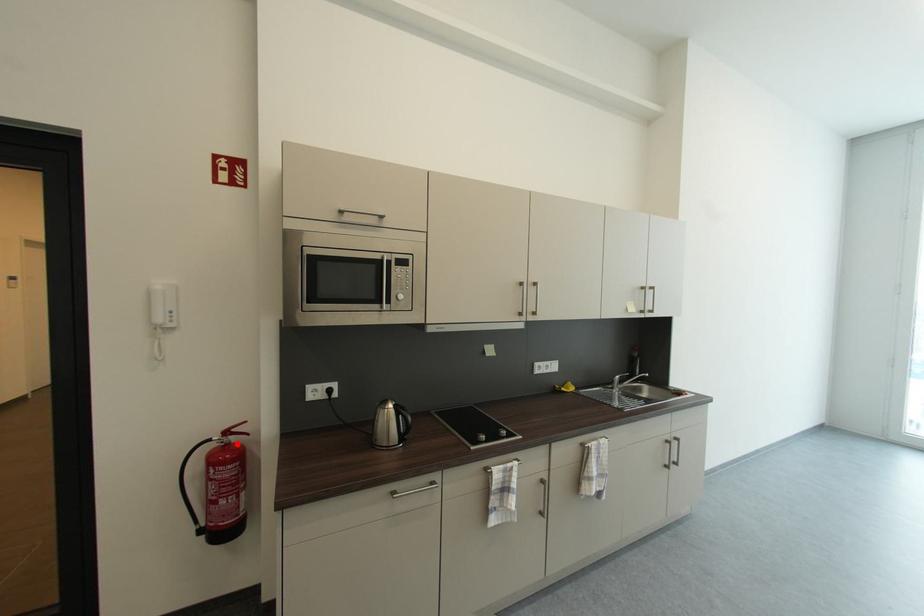
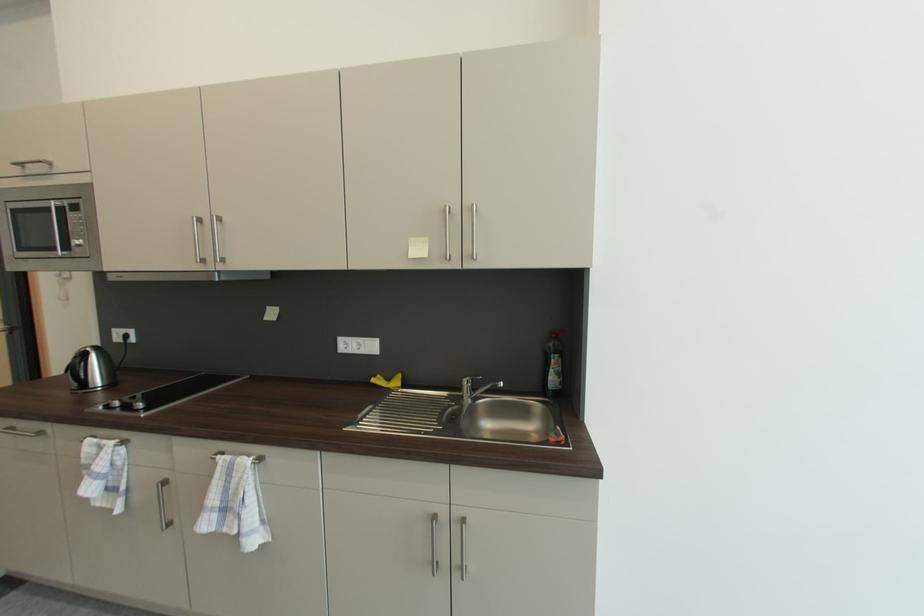
Question: I am providing you with two images of the same scene from different viewpoints. A red point is marked on the first image. Can you still see the location of the red point in image 2?

Choices:
 (A) Yes
 (B) No

Answer: (B)